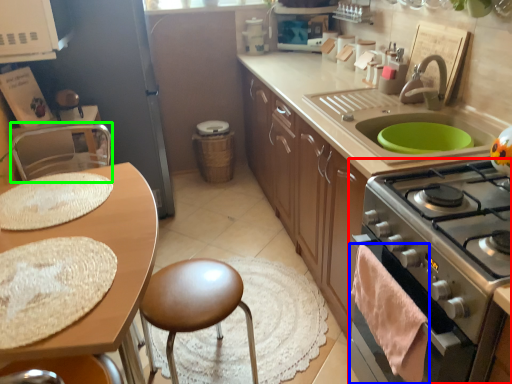
Question: Based on their relative distances, which object is nearer to kitchen appliance (highlighted by a red box)? Choose from material (highlighted by a blue box) and chair (highlighted by a green box).

Choices:
 (A) material
 (B) chair

Answer: (A)